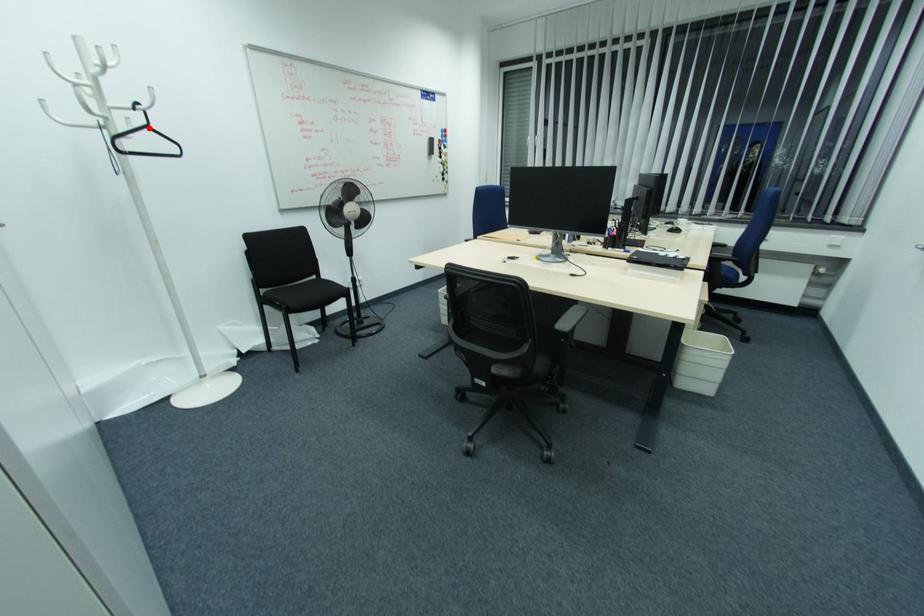
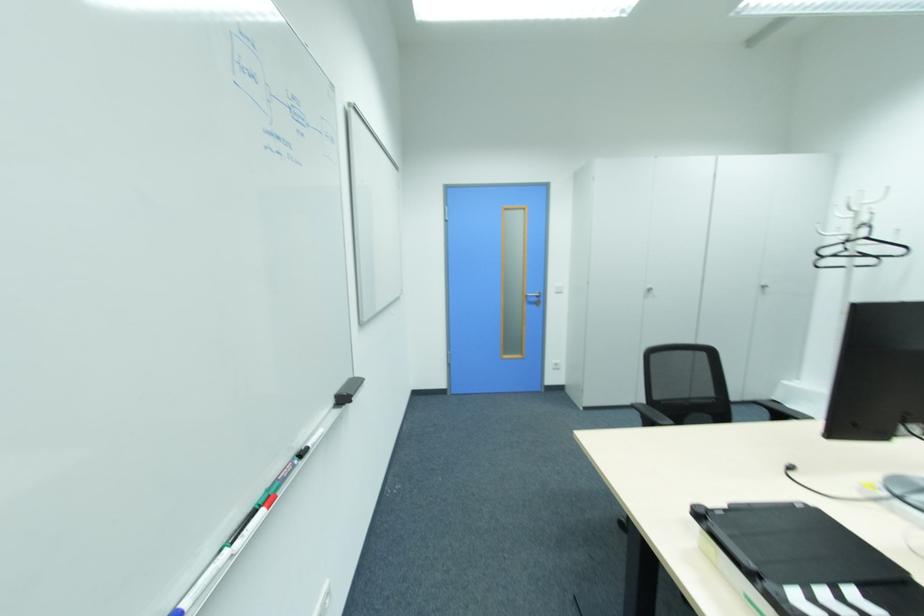
Find the pixel in the second image that matches the highlighted location in the first image.

(865, 238)